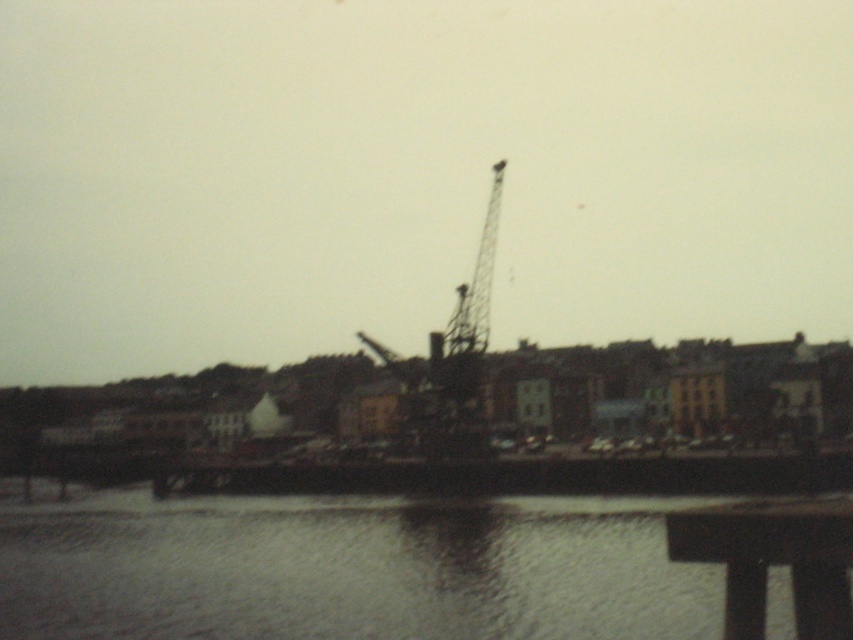
You are standing on the waterfront and see the smooth water at lower center and the metallic tower crane at center. Which object is taller from your viewpoint?

The metallic tower crane at center is taller than the smooth water at lower center.

In the scene shown: You are standing at the center of the waterfront scene. You want to locate the smooth water at lower center. According to its coordinates, which direction should you face to see it?

The smooth water at lower center is located at coordinates point (x=351, y=570), so you should face towards the lower right direction to see it.

You are standing at the waterfront and want to take a photo of both the point at coordinates point [729,602] and point [498,208]. Based on their positions, which point will appear larger in your camera view?

Point [729,602] is closer to the camera than point [498,208], so it will appear larger in the camera view.